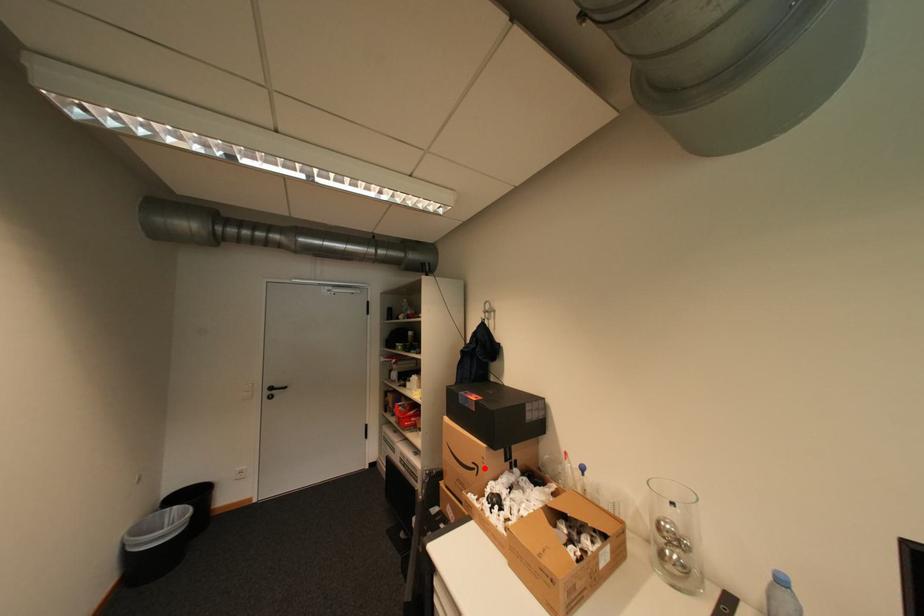
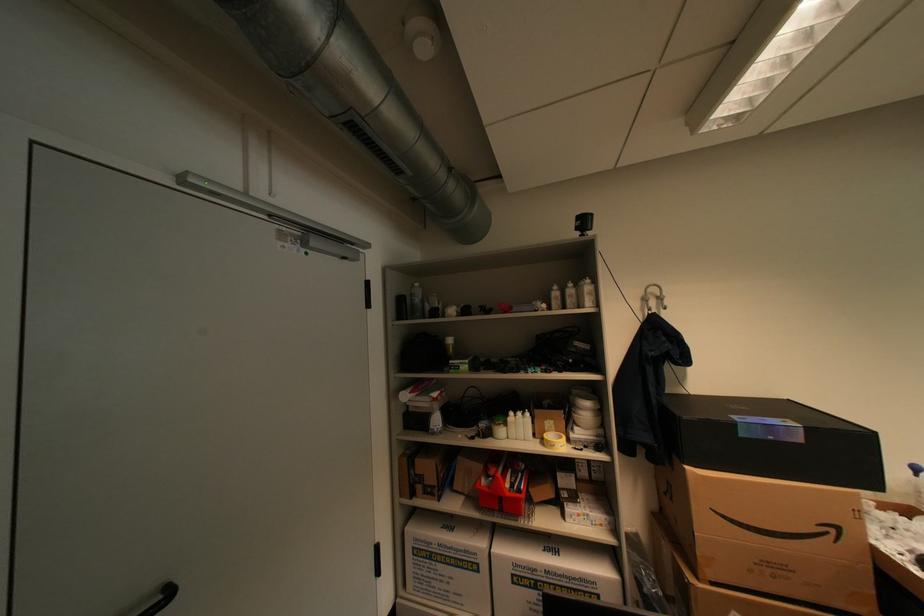
In the second image, find the point that corresponds to the highlighted location in the first image.

(841, 531)